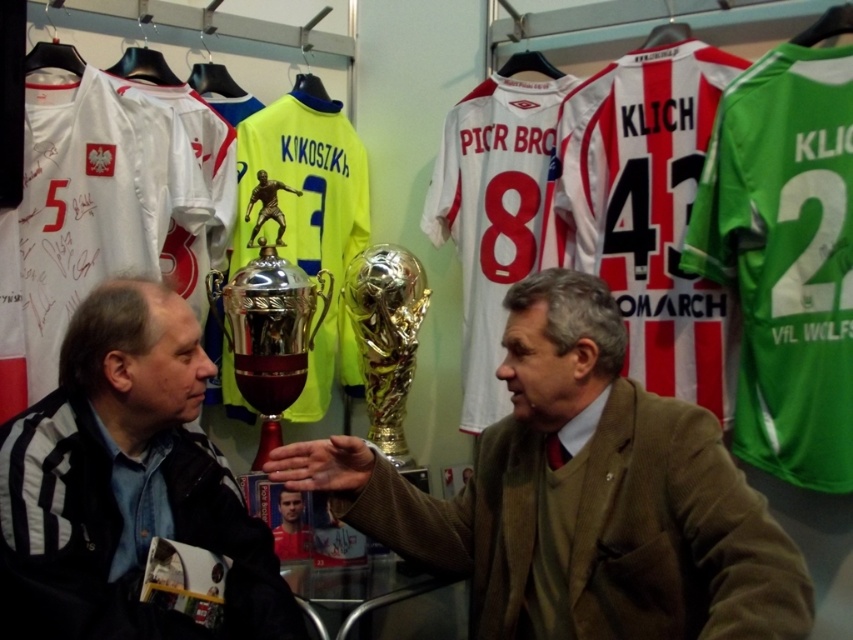
Question: Where is black leather jacket at center located in relation to gold metallic trophy at center in the image?

Choices:
 (A) below
 (B) above

Answer: (A)

Question: Which of the following is the closest to the observer?

Choices:
 (A) (x=756, y=492)
 (B) (x=283, y=324)
 (C) (x=48, y=401)

Answer: (A)

Question: Which object appears farthest from the camera in this image?

Choices:
 (A) silver/metallic trophy at center
 (B) black leather jacket at center
 (C) brown woolen jacket at center

Answer: (A)

Question: Estimate the real-world distances between objects in this image. Which object is farther from the gold metallic trophy at center?

Choices:
 (A) silver/metallic trophy at center
 (B) brown woolen jacket at center
 (C) black leather jacket at center

Answer: (C)

Question: Does brown woolen jacket at center lie in front of black leather jacket at center?

Choices:
 (A) yes
 (B) no

Answer: (A)

Question: Where is silver/metallic trophy at center located in relation to gold metallic trophy at center in the image?

Choices:
 (A) above
 (B) below

Answer: (A)